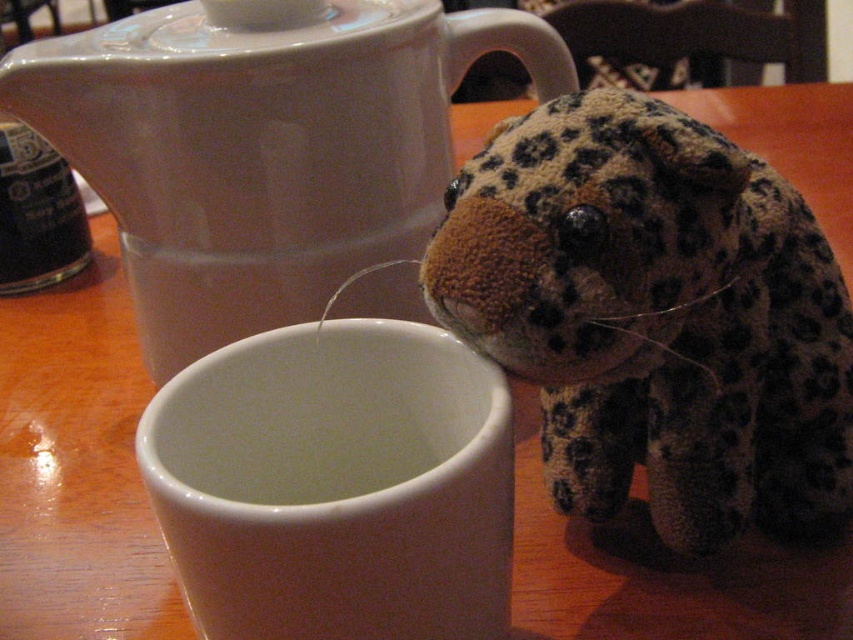
You are a small robot with a 10 inch wide arm. You need to pick up the white glossy teapot at upper center and the white glossy mug at center. Can your arm reach both items without moving your position?

The white glossy teapot at upper center and white glossy mug at center are 12.53 inches apart from each other. Since your arm is only 10 inches wide, you cannot reach both items at the same time without moving your position.

You are standing in front of the table and want to place a small decoration between the two points marked as point (830, 458) and point (152, 308). Which point should the decoration be closer to in order to be nearer to the viewer?

The decoration should be placed closer to point (830, 458) because it is closer to the viewer than point (152, 308).

You are a guest at a tea ceremony and need to pour tea from the white glossy teapot at upper center into the white matte cup at center. Can you do this without spilling, considering their sizes?

The white glossy teapot at upper center is taller than the white matte cup at center, so pouring tea from the taller teapot into the shorter cup should be manageable without spilling as long as you pour carefully.